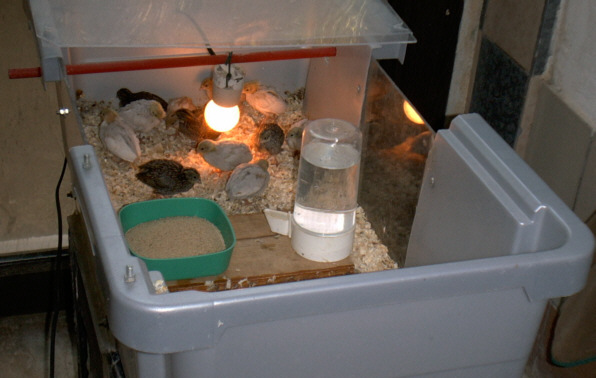
The image size is (596, 378). What are the coordinates of `heating light` in the screenshot? It's located at (215, 112).